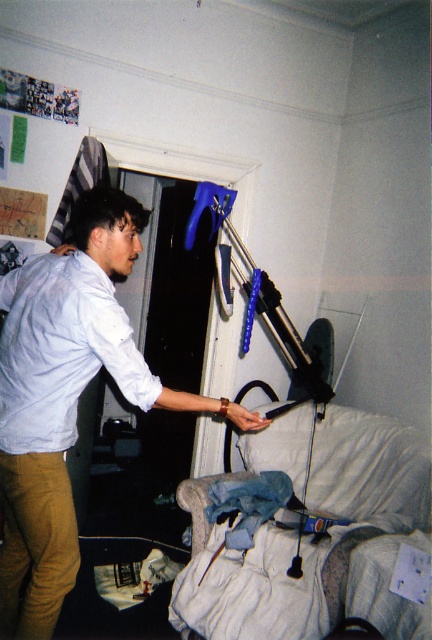
Question: Among these points, which one is farthest from the camera?

Choices:
 (A) (75, 561)
 (B) (104, 301)
 (C) (416, 499)

Answer: (C)

Question: Is light blue cotton shirt at center smaller than velvet blue hospital bed at lower right?

Choices:
 (A) yes
 (B) no

Answer: (A)

Question: Which point appears closest to the camera in this image?

Choices:
 (A) (97, 257)
 (B) (6, 400)
 (C) (241, 573)

Answer: (B)

Question: Does velvet blue hospital bed at lower right appear over light blue cotton shirt at left?

Choices:
 (A) yes
 (B) no

Answer: (B)

Question: Considering the real-world distances, which object is farthest from the light blue cotton shirt at center?

Choices:
 (A) light blue cotton shirt at left
 (B) velvet blue hospital bed at lower right

Answer: (B)

Question: Can you confirm if light blue cotton shirt at center is positioned above light blue cotton shirt at left?

Choices:
 (A) yes
 (B) no

Answer: (B)